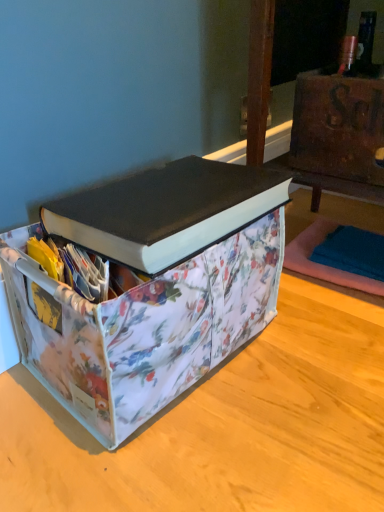
Locate an element on the screen. Image resolution: width=384 pixels, height=512 pixels. vacant area that lies in front of floral fabric storage bin at center is located at coordinates (184, 454).